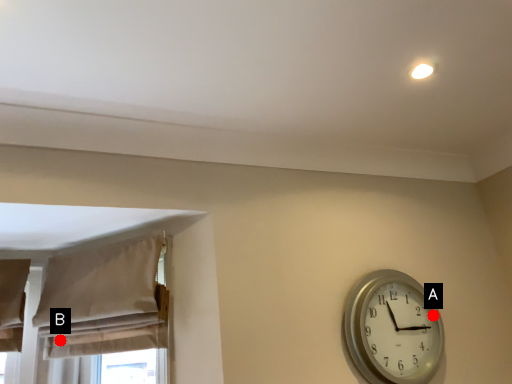
Question: Two points are circled on the image, labeled by A and B beside each circle. Which point is closer to the camera taking this photo?

Choices:
 (A) A is closer
 (B) B is closer

Answer: (B)